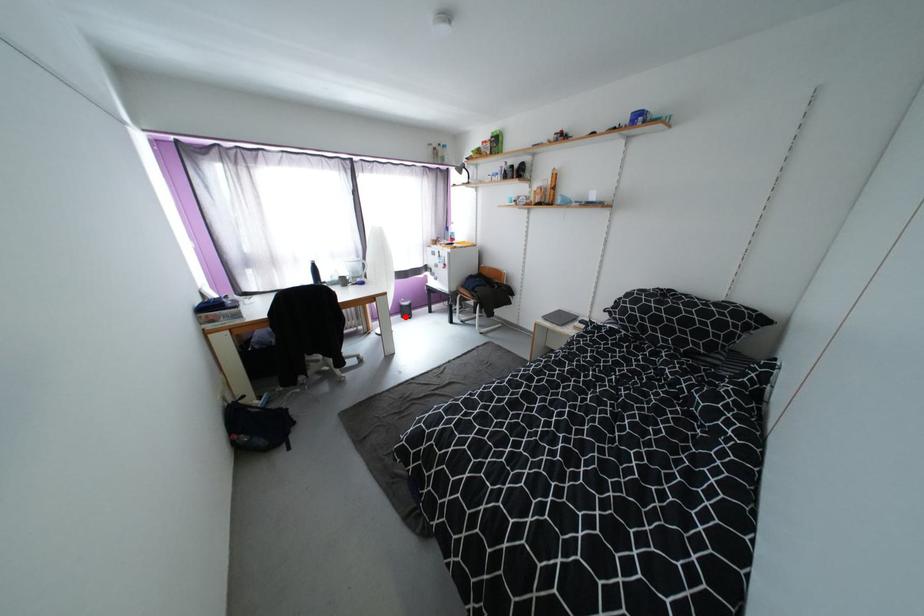
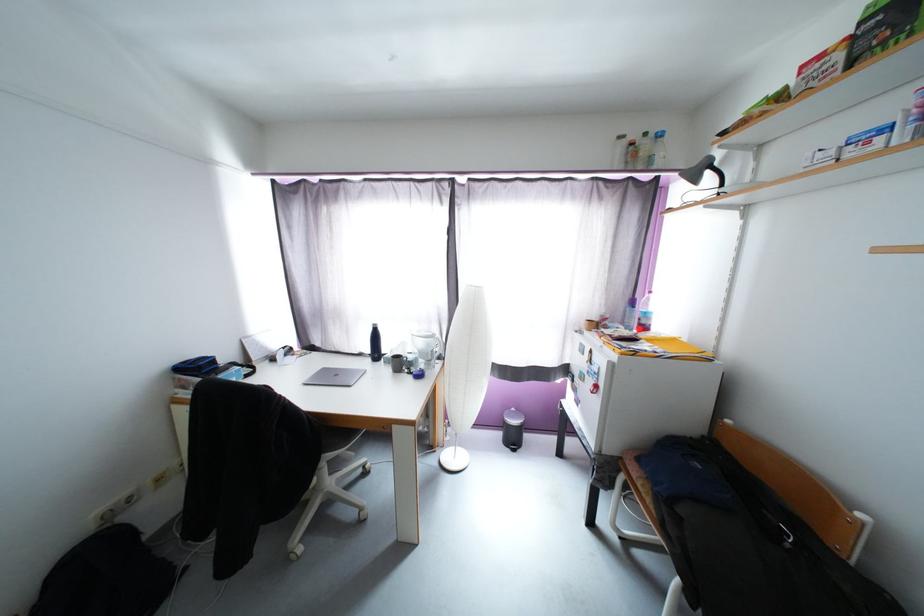
Question: I am providing you with two images of the same scene from different viewpoints. In image1, a red point is highlighted. Considering the same 3D point in image2, which of the following is correct?

Choices:
 (A) It is closer
 (B) It is farther

Answer: (B)